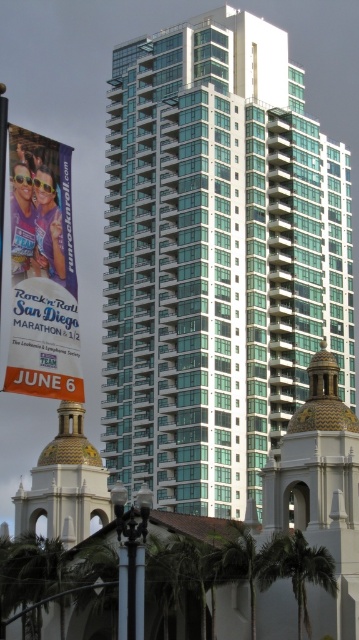
You are an architect analyzing the urban landscape. You notice the glassy teal building at center and the matte purple banner at left. Which object occupies more horizontal space in the scene?

The glassy teal building at center has a greater width than the matte purple banner at left, so it occupies more horizontal space.

You are a drone operator tasked with flying a drone between the white stucco dome at center and the gold textured dome at lower left. The drone has a maximum flight distance of 15 meters. Can the drone safely fly between them without exceeding its range?

The white stucco dome at center is 15.27 meters away from the gold textured dome at lower left. Since the drone has a maximum flight distance of 15 meters, it cannot safely fly between them without exceeding its range.

You are a photographer planning to capture both the glassy teal building at center and the matte purple banner at left in a single frame. Based on their positions, which object should you position closer to the left edge of your camera viewfinder?

The matte purple banner at left should be positioned closer to the left edge of the camera viewfinder since it is located to the left of the glassy teal building at center.